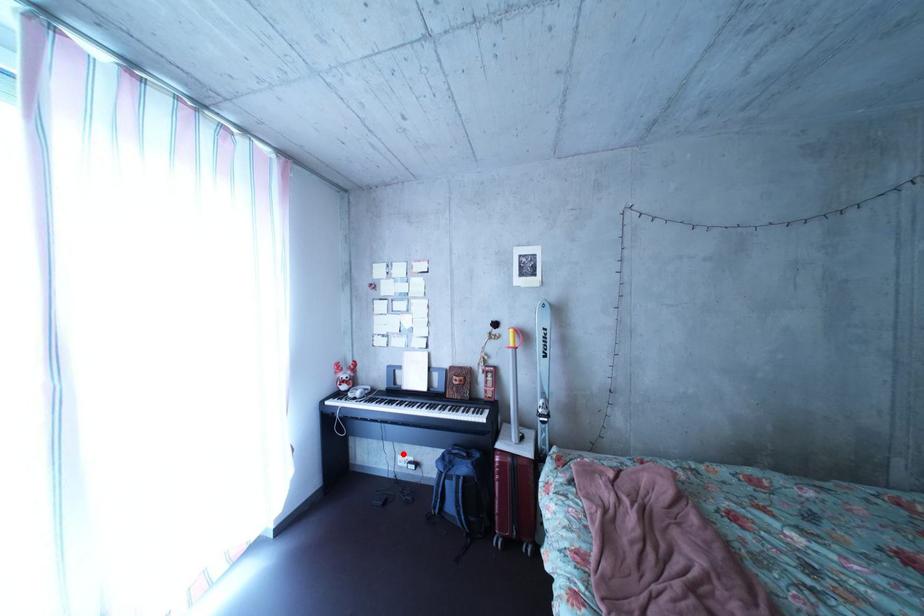
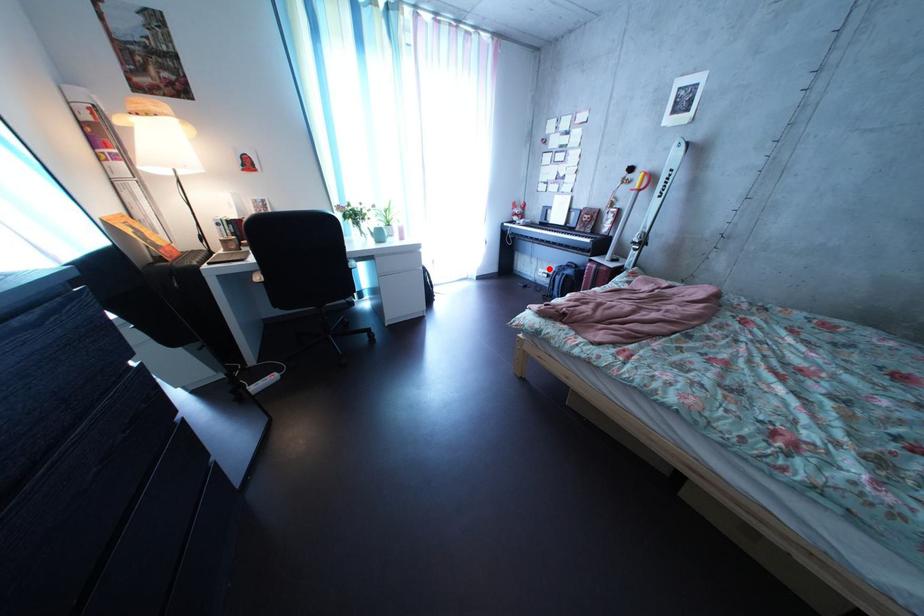
I am providing you with two images of the same scene from different viewpoints. A red point is marked on the first image and another point is marked on the second image. Does the point marked in image1 correspond to the same location as the one in image2?

Yes